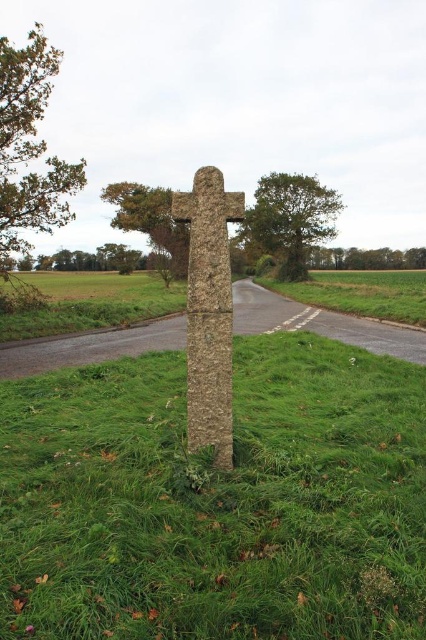
Does green grassy at center appear under rough stone cross at center?

Yes.

Is green grassy at center bigger than rough stone cross at center?

Yes, green grassy at center is bigger than rough stone cross at center.

At what (x,y) coordinates should I click in order to perform the action: click on green grassy at center. Please return your answer as a coordinate pair (x, y). Looking at the image, I should click on (215, 500).

The width and height of the screenshot is (426, 640). In order to click on green grassy at center in this screenshot , I will do `click(215, 500)`.

Image resolution: width=426 pixels, height=640 pixels. I want to click on green leafy tree at upper left, so click(x=29, y=147).

Does green leafy tree at upper left come in front of green leafy tree at center?

Yes, it is.

Where is `green leafy tree at upper left`? Image resolution: width=426 pixels, height=640 pixels. green leafy tree at upper left is located at coordinates (29, 147).

Does green leafy tree at upper left appear under green leafy tree at upper center?

No.

Measure the distance between green leafy tree at upper left and green leafy tree at upper center.

They are 30.36 meters apart.

Locate an element on the screen. This screenshot has height=640, width=426. green leafy tree at upper left is located at coordinates (29, 147).

The height and width of the screenshot is (640, 426). What are the coordinates of `green leafy tree at upper left` in the screenshot? It's located at (29, 147).